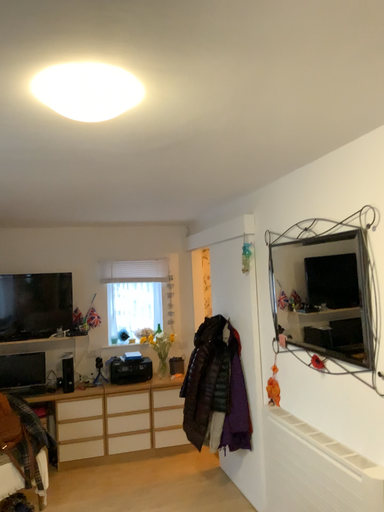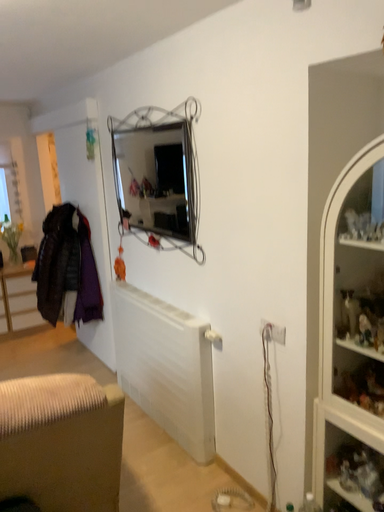
Question: Which way did the camera rotate in the video?

Choices:
 (A) rotated upward
 (B) rotated downward

Answer: (B)